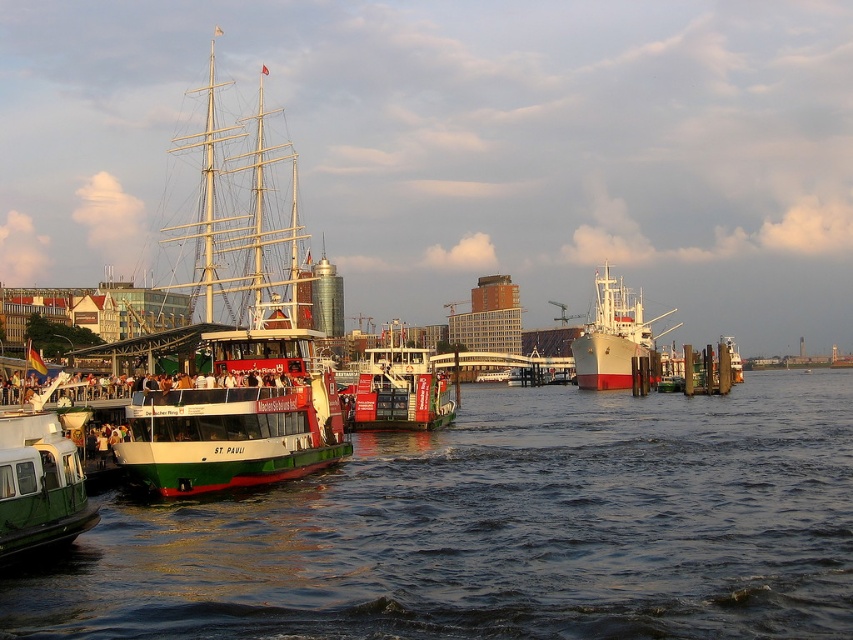
Question: Can you confirm if dark blue water at center is positioned to the right of red painted ferry at center?

Choices:
 (A) yes
 (B) no

Answer: (A)

Question: Does green matte ship at left appear under green matte barge at lower left?

Choices:
 (A) yes
 (B) no

Answer: (B)

Question: Among these objects, which one is farthest from the camera?

Choices:
 (A) green matte barge at lower left
 (B) red painted ferry at center
 (C) green matte ship at left

Answer: (B)

Question: Among these objects, which one is nearest to the camera?

Choices:
 (A) red painted ferry at center
 (B) dark blue water at center
 (C) green matte ship at left
 (D) white matte cargo ship at center

Answer: (B)

Question: Which is nearer to the white matte cargo ship at center?

Choices:
 (A) dark blue water at center
 (B) green matte ship at left
 (C) red painted ferry at center
 (D) green matte barge at lower left

Answer: (A)

Question: Observing the image, what is the correct spatial positioning of green matte barge at lower left in reference to red painted ferry at center?

Choices:
 (A) below
 (B) above

Answer: (A)